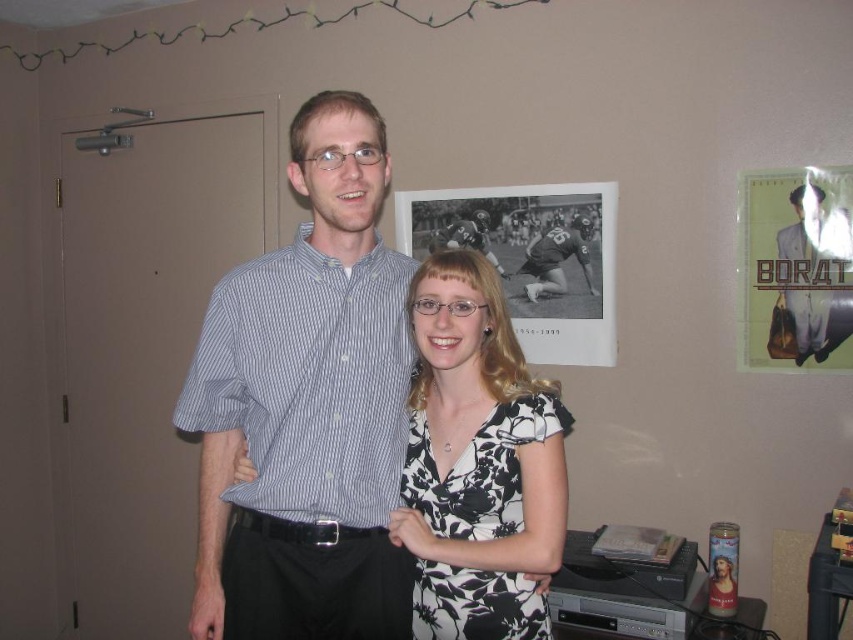
You are a delivery robot with a 1.2 meter long package. You need to move through the space between the striped cotton shirt at center and the black leather football player at center. Can you fit the package through that space?

The distance between the striped cotton shirt at center and the black leather football player at center is 1.05 meters. Since the package is 1.2 meters long, it cannot fit through the space between them.

You are a photographer setting up a backdrop for a photoshoot. The backdrop is 1.8 meters wide. You have two outfits to photograph, the striped cotton shirt at center and the black floral dress at center. Based on the image, can you determine if both outfits can fit side by side on the backdrop without overlapping?

The striped cotton shirt at center might be wider than black floral dress at center, so it is uncertain if both can fit side by side on the 1.8 meter wide backdrop without overlapping. Further measurement is needed to confirm.

You are a photographer setting up a shoot in a room with a beige wall and decorative lights. You notice two outfits displayed at the center of the image. The striped cotton shirt at center and the black floral dress at center. Which outfit is visible above the other?

The striped cotton shirt at center is positioned over the black floral dress at center, so the striped cotton shirt at center is visible above the black floral dress at center.